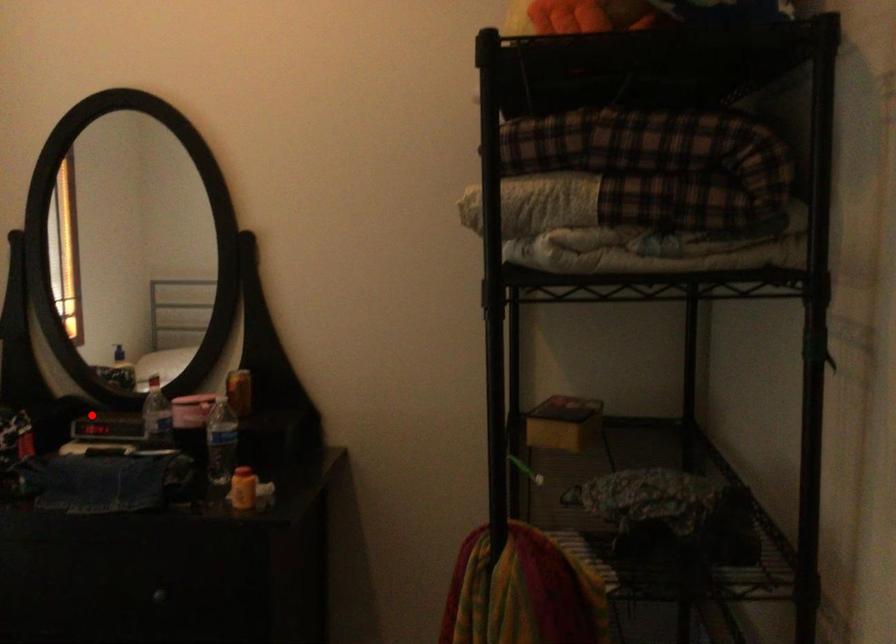
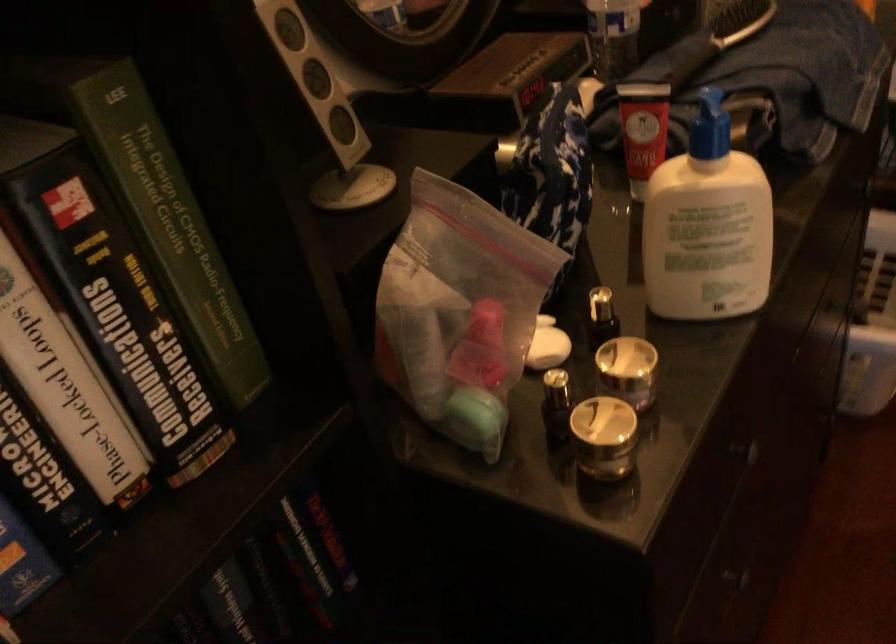
Find the pixel in the second image that matches the highlighted location in the first image.

(506, 80)